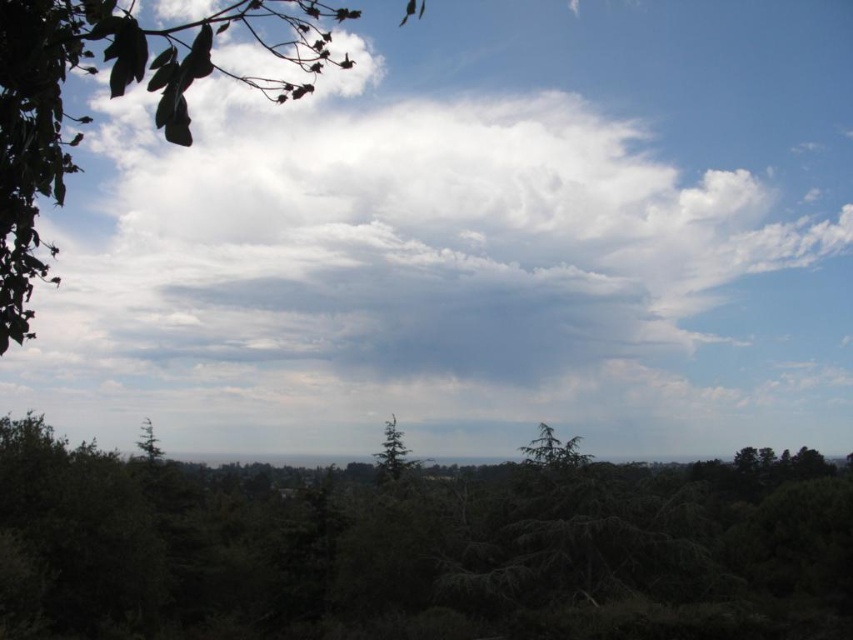
You are an artist sketching this landscape and want to ensure proper perspective. Based on the arrangement of the green textured tree at center and the green matte tree at lower left, which tree should you draw first to maintain depth perception?

You should draw the green matte tree at lower left first because the green textured tree at center is in front of it, so the background tree should be sketched before the foreground elements to maintain depth perception.

You are standing in the middle of the forest looking up at the sky. You see a point marked at coordinates (553, 449). What object is located at that point?

The point at coordinates (553, 449) corresponds to the green textured tree at center.

You are standing in the serene landscape looking at the vast sky and trees. You notice two points marked in the image. Which point is closer to you, point [73,500] or point [151,454]?

Point [73,500] is closer to the viewer than point [151,454].